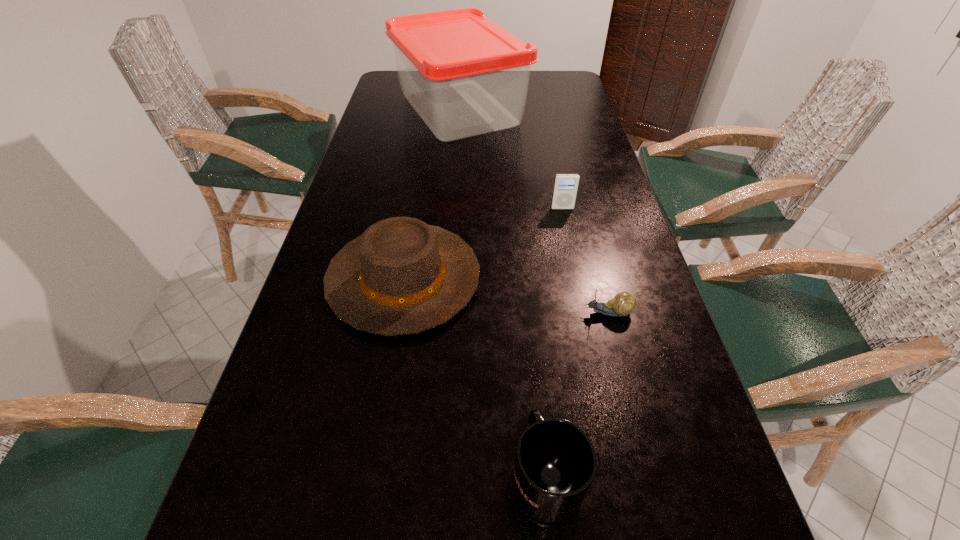
Locate an element on the screen. Image resolution: width=960 pixels, height=540 pixels. vacant area that lies between the iPod and the cowboy hat is located at coordinates (483, 244).

Where is `vacant region between the escargot and the tallest object`? The image size is (960, 540). vacant region between the escargot and the tallest object is located at coordinates (534, 211).

You are a GUI agent. You are given a task and a screenshot of the screen. Output one action in this format:
    pyautogui.click(x=<x>, y=<y>)
    Task: Click on the free space between the nearest object and the second farthest object
    
    Given the screenshot: What is the action you would take?
    pyautogui.click(x=554, y=342)

Locate an element on the screen. The image size is (960, 540). empty space between the tallest object and the shortest object is located at coordinates (534, 211).

What are the coordinates of `vacant space that's between the iPod and the tray` in the screenshot? It's located at (511, 159).

Find the location of a particular element. This screenshot has height=540, width=960. the closest object to the farthest object is located at coordinates (566, 185).

Choose which object is the fourth nearest neighbor to the iPod. Please provide its 2D coordinates. Your answer should be formatted as a tuple, i.e. [(x, y)], where the tuple contains the x and y coordinates of a point satisfying the conditions above.

[(555, 463)]

Locate an element on the screen. vacant space that satisfies the following two spatial constraints: 1. on the back side of the farthest object; 2. on the left side of the cowboy hat is located at coordinates (432, 109).